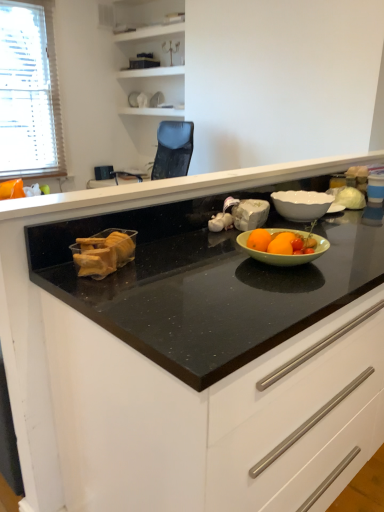
Question: From a real-world perspective, is translucent plastic baguette at left on top of white glossy bowl at upper right?

Choices:
 (A) yes
 (B) no

Answer: (B)

Question: Would you say translucent plastic baguette at left is outside white glossy bowl at upper right?

Choices:
 (A) yes
 (B) no

Answer: (A)

Question: Is translucent plastic baguette at left in front of white glossy bowl at upper right?

Choices:
 (A) no
 (B) yes

Answer: (B)

Question: Considering the relative sizes of translucent plastic baguette at left and white glossy bowl at upper right in the image provided, is translucent plastic baguette at left shorter than white glossy bowl at upper right?

Choices:
 (A) no
 (B) yes

Answer: (A)

Question: Is translucent plastic baguette at left surrounding white glossy bowl at upper right?

Choices:
 (A) no
 (B) yes

Answer: (A)

Question: Does translucent plastic baguette at left appear on the left side of white glossy bowl at upper right?

Choices:
 (A) no
 (B) yes

Answer: (B)

Question: Can you confirm if black granite countertop at center is thinner than white blinds at left?

Choices:
 (A) yes
 (B) no

Answer: (A)

Question: Are black granite countertop at center and white blinds at left located far from each other?

Choices:
 (A) yes
 (B) no

Answer: (A)

Question: Is black granite countertop at center taller than white blinds at left?

Choices:
 (A) no
 (B) yes

Answer: (A)

Question: From the image's perspective, is black granite countertop at center beneath white blinds at left?

Choices:
 (A) no
 (B) yes

Answer: (B)

Question: Is black granite countertop at center aimed at white blinds at left?

Choices:
 (A) no
 (B) yes

Answer: (B)

Question: Is black granite countertop at center shorter than white blinds at left?

Choices:
 (A) no
 (B) yes

Answer: (B)

Question: Is black granite countertop at center not inside white glossy bowl at upper right?

Choices:
 (A) yes
 (B) no

Answer: (A)